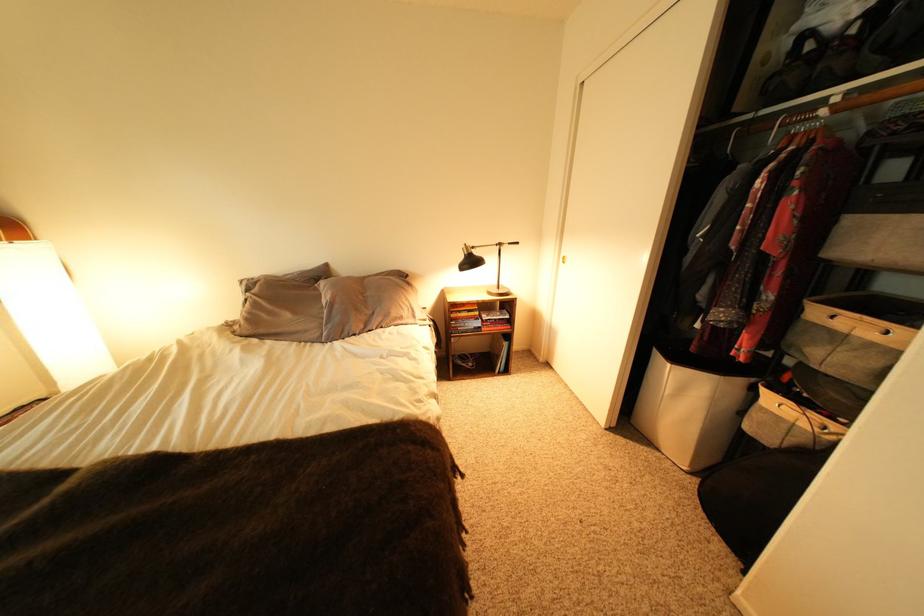
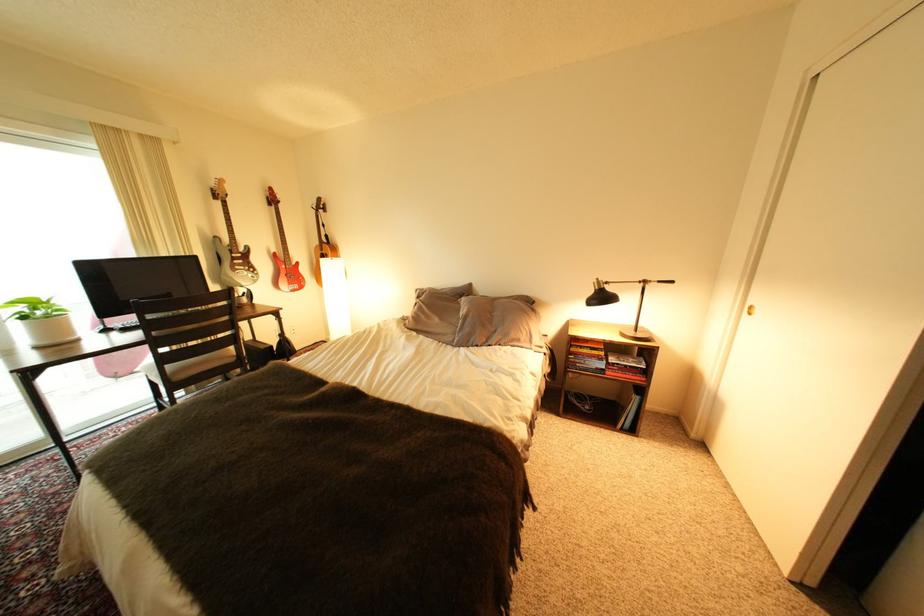
In the second image, find the point that corresponds to (332,286) in the first image.

(473, 302)